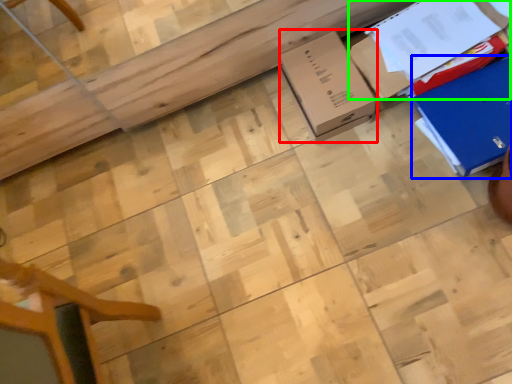
Question: Which object is positioned farthest from cardboard box (highlighted by a red box)? Select from cardboard box (highlighted by a blue box) and cardboard box (highlighted by a green box).

Choices:
 (A) cardboard box
 (B) cardboard box

Answer: (A)